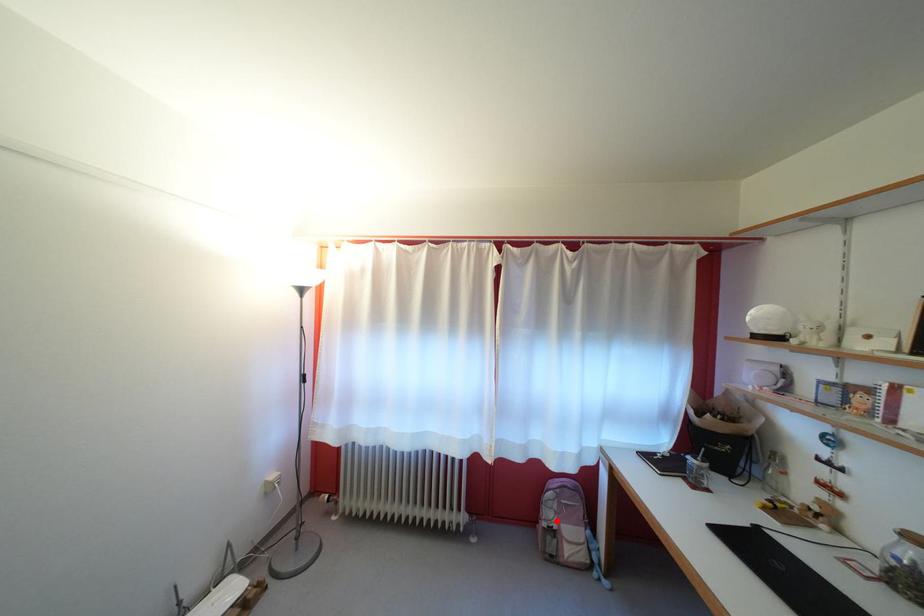
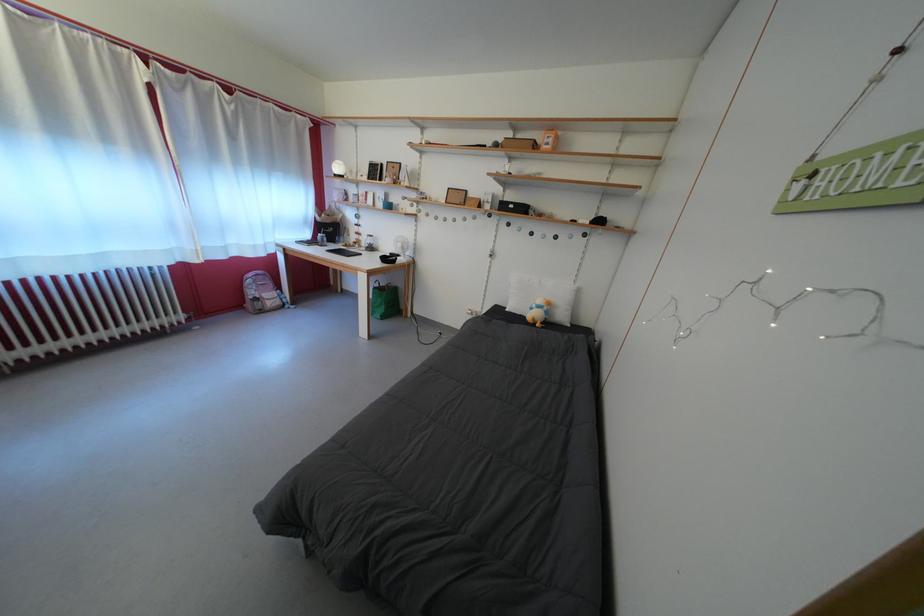
Question: I am providing you with two images of the same scene from different viewpoints. A red point is shown in image1. For the corresponding object point in image2, is it positioned nearer or farther from the camera?

Choices:
 (A) Nearer
 (B) Farther

Answer: (A)